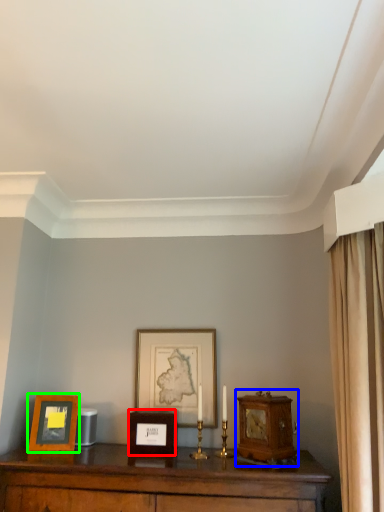
Question: Which object is positioned closest to picture frame (highlighted by a red box)? Select from alarm clock (highlighted by a blue box) and picture frame (highlighted by a green box).

Choices:
 (A) alarm clock
 (B) picture frame

Answer: (B)